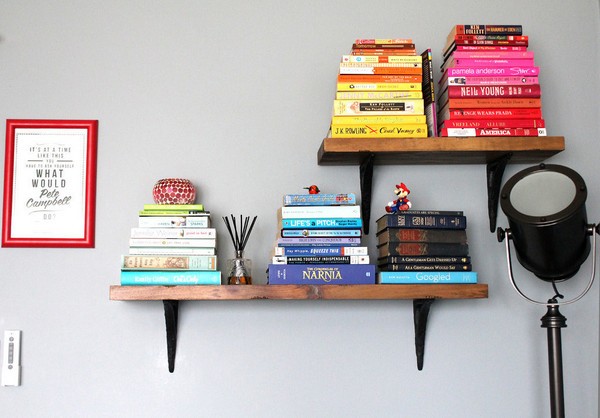
Find the location of a particular element. yellow books is located at coordinates (348, 128), (343, 104), (361, 94), (359, 86), (366, 65), (374, 59).